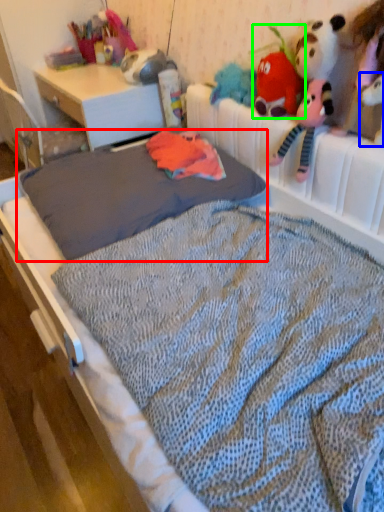
Question: Considering the real-world distances, which object is farthest from mattress (highlighted by a red box)? toy (highlighted by a blue box) or toy (highlighted by a green box)?

Choices:
 (A) toy
 (B) toy

Answer: (A)